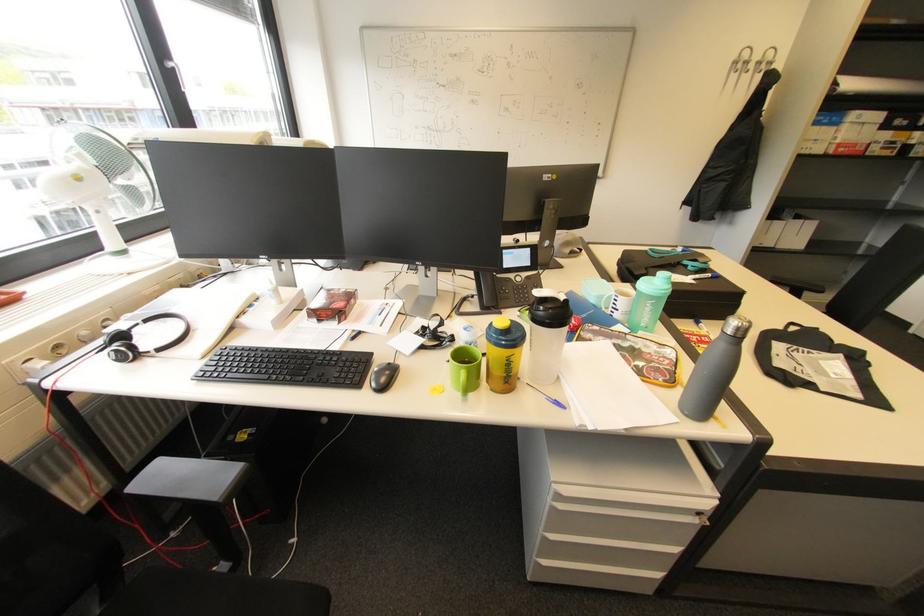
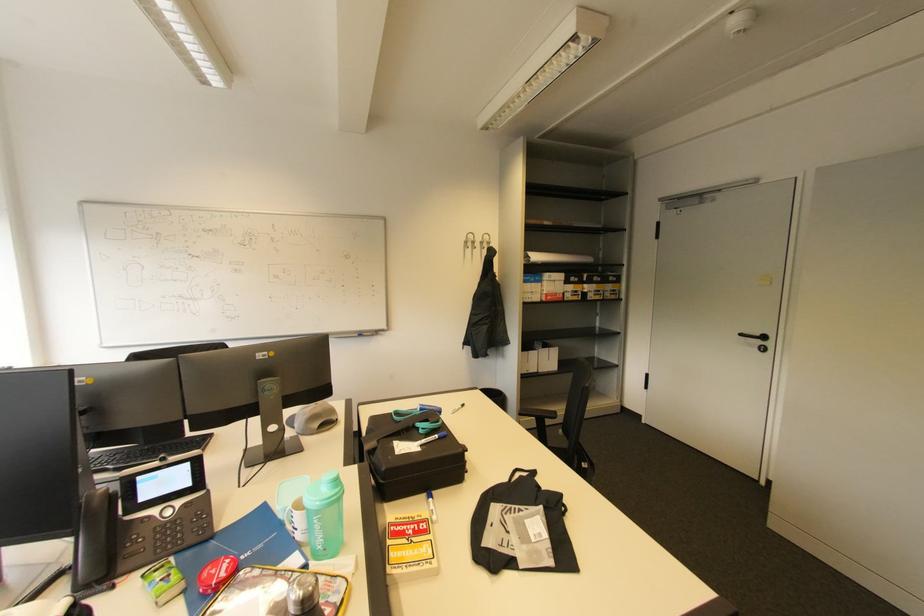
In the second image, find the point that corresponds to (x=622, y=310) in the first image.

(300, 531)